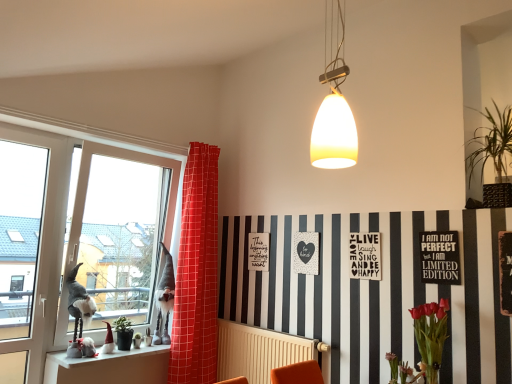
Where is `black wood sign at right, the 2th bulletin board positioned from the left`? The height and width of the screenshot is (384, 512). black wood sign at right, the 2th bulletin board positioned from the left is located at coordinates (505, 271).

Based on the photo, measure the distance between white matte postcard at center, arranged as the 2th postcard when viewed from the right, and camera.

The distance of white matte postcard at center, arranged as the 2th postcard when viewed from the right, from camera is 3.11 meters.

Image resolution: width=512 pixels, height=384 pixels. Describe the element at coordinates (258, 252) in the screenshot. I see `white matte postcard at center, arranged as the 2th postcard when viewed from the right` at that location.

This screenshot has height=384, width=512. What do you see at coordinates (440, 257) in the screenshot?
I see `black matte signboard at upper right, which is the first bulletin board in left-to-right order` at bounding box center [440, 257].

This screenshot has height=384, width=512. What do you see at coordinates (92, 237) in the screenshot? I see `transparent glass window at left` at bounding box center [92, 237].

Locate an element on the screen. The width and height of the screenshot is (512, 384). black wood sign at right, the 1th bulletin board from the right is located at coordinates click(x=505, y=271).

Does point (508, 278) come farther from viewer compared to point (189, 370)?

That is False.

Is black wood sign at right, the 2th bulletin board positioned from the left, taller or shorter than red checkered curtain at window?

Clearly, black wood sign at right, the 2th bulletin board positioned from the left, is shorter compared to red checkered curtain at window.

Would you say red checkered curtain at window is part of black wood sign at right, the 1th bulletin board from the right,'s contents?

Definitely not — red checkered curtain at window is not inside black wood sign at right, the 1th bulletin board from the right.

From a real-world perspective, is black wood sign at right, the first bulletin board from the front, on top of red checkered curtain at window?

Correct, in the physical world, black wood sign at right, the first bulletin board from the front, is higher than red checkered curtain at window.

Can you see white ceramic gnomes at lower left touching green matte plant at lower left, which ranks as the first plant in bottom-to-top order?

No, white ceramic gnomes at lower left is not in contact with green matte plant at lower left, which ranks as the first plant in bottom-to-top order.

Is green matte plant at lower left, the second plant from the right, at the back of white ceramic gnomes at lower left?

No, white ceramic gnomes at lower left is not facing away from green matte plant at lower left, the second plant from the right.

From the image's perspective, is white ceramic gnomes at lower left under green matte plant at lower left, the second plant from the right?

Yes.

Does white ceramic gnomes at lower left appear on the left side of green matte plant at lower left, the 2th plant positioned from the top?

Correct, you'll find white ceramic gnomes at lower left to the left of green matte plant at lower left, the 2th plant positioned from the top.

From the image's perspective, is matte white pendant light at upper center positioned above or below transparent glass screen door at left?

From the image's perspective, matte white pendant light at upper center appears above transparent glass screen door at left.

Based on the photo, from a real-world perspective, relative to transparent glass screen door at left, is matte white pendant light at upper center vertically above or below?

Clearly, from a real-world perspective, matte white pendant light at upper center is above transparent glass screen door at left.

Choose the correct answer: Is matte white pendant light at upper center inside transparent glass screen door at left or outside it?

matte white pendant light at upper center lies outside transparent glass screen door at left.

Relative to white ceramic gnomes at lower left, is transparent glass window at left in front or behind?

transparent glass window at left is behind white ceramic gnomes at lower left.

Is transparent glass window at left directly adjacent to white ceramic gnomes at lower left?

No, transparent glass window at left is not beside white ceramic gnomes at lower left.

Is transparent glass window at left at the right side of white ceramic gnomes at lower left?

In fact, transparent glass window at left is to the left of white ceramic gnomes at lower left.

Is black matte signboard at upper right, arranged as the second bulletin board when viewed from the front, situated inside white matte postcard at center, the first postcard when ordered from left to right, or outside?

black matte signboard at upper right, arranged as the second bulletin board when viewed from the front, is spatially situated outside white matte postcard at center, the first postcard when ordered from left to right.

Relative to white matte postcard at center, placed as the second postcard when sorted from front to back, is black matte signboard at upper right, which is the first bulletin board in left-to-right order, in front or behind?

In the image, black matte signboard at upper right, which is the first bulletin board in left-to-right order, appears in front of white matte postcard at center, placed as the second postcard when sorted from front to back.

Is black matte signboard at upper right, arranged as the second bulletin board when viewed from the front, looking in the opposite direction of white matte postcard at center, arranged as the 2th postcard when viewed from the right?

No, white matte postcard at center, arranged as the 2th postcard when viewed from the right, is not at the back of black matte signboard at upper right, arranged as the second bulletin board when viewed from the front.

Looking at their sizes, would you say black matte signboard at upper right, arranged as the second bulletin board when viewed from the front, is wider or thinner than white matte postcard at center, placed as the second postcard when sorted from front to back?

Clearly, black matte signboard at upper right, arranged as the second bulletin board when viewed from the front, has more width compared to white matte postcard at center, placed as the second postcard when sorted from front to back.

From the image's perspective, is black wood sign at right, arranged as the second bulletin board when viewed from the back, on green matte plant at lower left, which appears as the second plant when viewed from the front?

Yes, from the image's perspective, black wood sign at right, arranged as the second bulletin board when viewed from the back, is on top of green matte plant at lower left, which appears as the second plant when viewed from the front.

From a real-world perspective, is black wood sign at right, arranged as the second bulletin board when viewed from the back, over green matte plant at lower left, arranged as the 1th plant when viewed from the left?

Yes, from a real-world perspective, black wood sign at right, arranged as the second bulletin board when viewed from the back, is above green matte plant at lower left, arranged as the 1th plant when viewed from the left.

How different are the orientations of black wood sign at right, the 1th bulletin board from the right, and green matte plant at lower left, the second plant from the right, in degrees?

black wood sign at right, the 1th bulletin board from the right, and green matte plant at lower left, the second plant from the right, are facing 91.8 degrees away from each other.

Which is correct: transparent glass window at left is inside beige radiator at lower center, or outside of it?

transparent glass window at left exists outside the volume of beige radiator at lower center.

You are a GUI agent. You are given a task and a screenshot of the screen. Output one action in this format:
    pyautogui.click(x=<x>, y=<y>)
    Task: Click on the radiator in front of the transparent glass window at left
    
    Given the screenshot: What is the action you would take?
    pyautogui.click(x=259, y=351)

Which of these two, transparent glass window at left or beige radiator at lower center, is thinner?

beige radiator at lower center is thinner.

From a real-world perspective, which bulletin board is the 1st one above the red checkered curtain at window? Please provide its 2D coordinates.

[(505, 271)]

The width and height of the screenshot is (512, 384). Find the location of `window sill below the green matte plant at lower left, which ranks as the first plant in bottom-to-top order (from the image's perspective)`. window sill below the green matte plant at lower left, which ranks as the first plant in bottom-to-top order (from the image's perspective) is located at coordinates (110, 367).

When comparing their distances from white ceramic gnomes at lower left, does black matte signboard at upper right, which is the first bulletin board in left-to-right order, or matte white pendant light at upper center seem further?

matte white pendant light at upper center lies further to white ceramic gnomes at lower left than the other object.

Estimate the real-world distances between objects in this image. Which object is further from red checkered curtain at window, transparent glass screen door at left or green matte plant at lower left, arranged as the 1th plant when viewed from the back?

transparent glass screen door at left.

Considering their positions, is green matte plant at lower left, arranged as the 1th plant when viewed from the back, positioned further to black matte signboard at upper right, which appears as the second bulletin board when viewed from the right, than green leafy plant at upper right, acting as the 2th plant starting from the left?

Among the two, green matte plant at lower left, arranged as the 1th plant when viewed from the back, is located further to black matte signboard at upper right, which appears as the second bulletin board when viewed from the right.

When comparing their distances from black matte signboard at upper right, which appears as the second bulletin board when viewed from the right, does white matte postcard at center, the first postcard when ordered from left to right, or transparent glass window at left seem closer?

Based on the image, white matte postcard at center, the first postcard when ordered from left to right, appears to be nearer to black matte signboard at upper right, which appears as the second bulletin board when viewed from the right.

From the image, which object appears to be farther from transparent glass window at left, green leafy plant at upper right, which appears as the 2th plant when viewed from the back, or transparent glass screen door at left?

Among the two, green leafy plant at upper right, which appears as the 2th plant when viewed from the back, is located further to transparent glass window at left.

Based on their spatial positions, is green matte plant at lower left, which ranks as the first plant in bottom-to-top order, or white ceramic gnomes at lower left closer to matte white pendant light at upper center?

The object closer to matte white pendant light at upper center is green matte plant at lower left, which ranks as the first plant in bottom-to-top order.

When comparing their distances from transparent glass screen door at left, does black wood sign at right, arranged as the second bulletin board when viewed from the back, or white ceramic gnomes at lower left seem further?

black wood sign at right, arranged as the second bulletin board when viewed from the back, is further to transparent glass screen door at left.

Estimate the real-world distances between objects in this image. Which object is closer to transparent glass screen door at left, beige radiator at lower center or black matte signboard at upper center, placed as the 2th postcard when sorted from back to front?

The object closer to transparent glass screen door at left is beige radiator at lower center.

The image size is (512, 384). Find the location of `bulletin board situated between white matte postcard at center, placed as the second postcard when sorted from front to back, and green leafy plant at upper right, which is the 1th plant in right-to-left order, from left to right`. bulletin board situated between white matte postcard at center, placed as the second postcard when sorted from front to back, and green leafy plant at upper right, which is the 1th plant in right-to-left order, from left to right is located at coordinates (440, 257).

At what (x,y) coordinates should I click in order to perform the action: click on bulletin board situated between transparent glass screen door at left and green leafy plant at upper right, which is the 1th plant in right-to-left order, from left to right. Please return your answer as a coordinate pair (x, y). Looking at the image, I should click on (440, 257).

You are a GUI agent. You are given a task and a screenshot of the screen. Output one action in this format:
    pyautogui.click(x=<x>, y=<y>)
    Task: Click on the bulletin board positioned between black wood sign at right, the 1th bulletin board from the right, and black matte signboard at upper center, placed as the 2th postcard when sorted from back to front, from near to far
    
    Given the screenshot: What is the action you would take?
    pyautogui.click(x=440, y=257)

Image resolution: width=512 pixels, height=384 pixels. I want to click on plant situated between black matte signboard at upper center, placed as the 2th postcard when sorted from back to front, and black wood sign at right, the 1th bulletin board from the right, from left to right, so click(x=490, y=142).